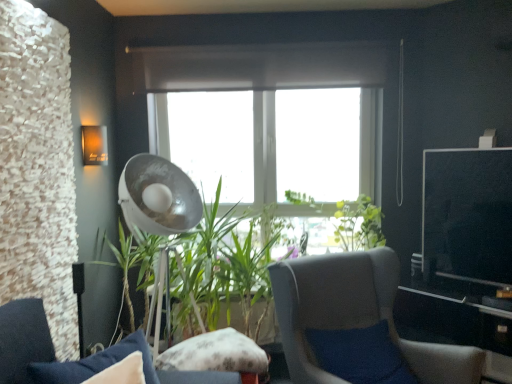
Question: Could you tell me if fluffy fabric pillow at center is turned towards gray fabric chair at center, the first chair when ordered from right to left?

Choices:
 (A) no
 (B) yes

Answer: (A)

Question: From a real-world perspective, is fluffy fabric pillow at center located higher than gray fabric chair at center, the 2th chair when ordered from left to right?

Choices:
 (A) no
 (B) yes

Answer: (A)

Question: Is fluffy fabric pillow at center wider than gray fabric chair at center, the 2th chair when ordered from left to right?

Choices:
 (A) yes
 (B) no

Answer: (B)

Question: Is the position of fluffy fabric pillow at center less distant than that of gray fabric chair at center, the first chair when ordered from right to left?

Choices:
 (A) no
 (B) yes

Answer: (A)

Question: Is fluffy fabric pillow at center beside gray fabric chair at center, the first chair when ordered from right to left?

Choices:
 (A) yes
 (B) no

Answer: (B)

Question: Relative to matte orange wall sconce at upper left, is velvet blue cushion at lower left, arranged as the 1th chair when viewed from the left, in front or behind?

Choices:
 (A) front
 (B) behind

Answer: (A)

Question: Is point tap(67, 374) closer or farther from the camera than point tap(91, 162)?

Choices:
 (A) farther
 (B) closer

Answer: (B)

Question: Would you say velvet blue cushion at lower left, arranged as the 1th chair when viewed from the left, is to the left or to the right of matte orange wall sconce at upper left in the picture?

Choices:
 (A) left
 (B) right

Answer: (B)

Question: Looking at their shapes, would you say velvet blue cushion at lower left, the 2th chair from the right, is wider or thinner than matte orange wall sconce at upper left?

Choices:
 (A) thin
 (B) wide

Answer: (B)

Question: Looking at the image, does fluffy fabric pillow at center seem bigger or smaller compared to velvet blue cushion at lower left, arranged as the 1th chair when viewed from the left?

Choices:
 (A) big
 (B) small

Answer: (B)

Question: Do you think fluffy fabric pillow at center is within velvet blue cushion at lower left, the 2th chair from the right, or outside of it?

Choices:
 (A) outside
 (B) inside

Answer: (A)

Question: Based on their positions, is fluffy fabric pillow at center located to the left or right of velvet blue cushion at lower left, arranged as the 1th chair when viewed from the left?

Choices:
 (A) left
 (B) right

Answer: (B)

Question: From the image's perspective, relative to velvet blue cushion at lower left, the 2th chair from the right, is fluffy fabric pillow at center above or below?

Choices:
 (A) below
 (B) above

Answer: (A)

Question: From a real-world perspective, is green leafy plant at center physically located above or below velvet blue cushion at lower left, arranged as the 1th chair when viewed from the left?

Choices:
 (A) below
 (B) above

Answer: (A)

Question: From the image's perspective, is green leafy plant at center positioned above or below velvet blue cushion at lower left, the 2th chair from the right?

Choices:
 (A) above
 (B) below

Answer: (A)